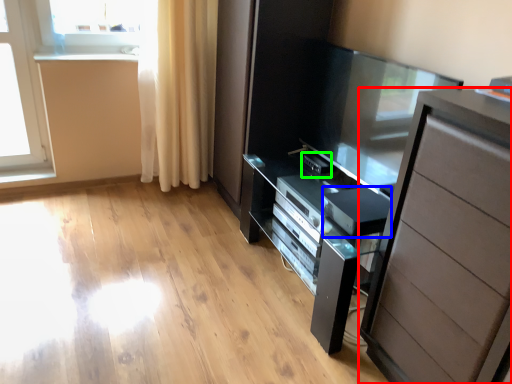
Question: Based on their relative distances, which object is nearer to chest of drawers (highlighted by a red box)? Choose from appliance (highlighted by a blue box) and appliance (highlighted by a green box).

Choices:
 (A) appliance
 (B) appliance

Answer: (A)